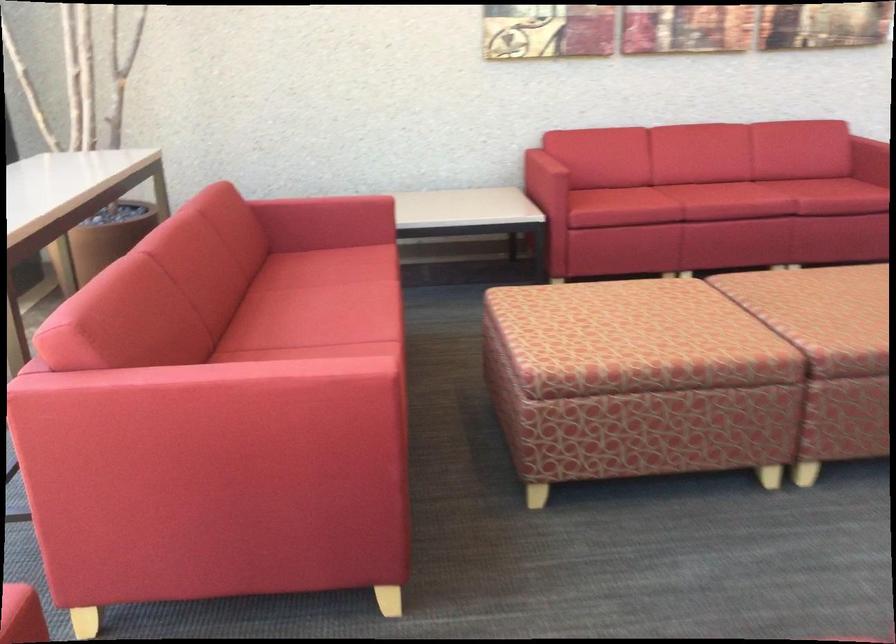
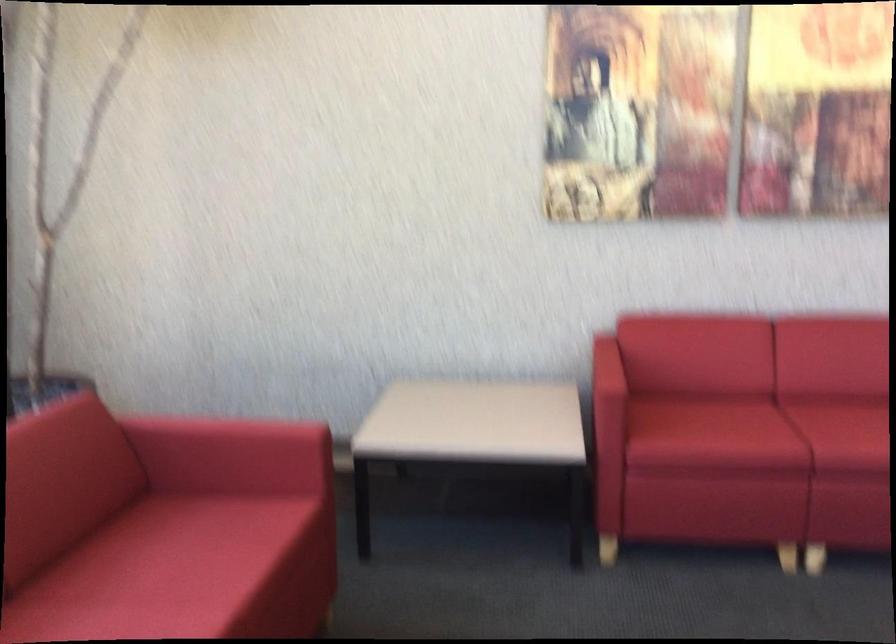
The point at [553,160] is marked in the first image. Where is the corresponding point in the second image?

(607, 377)